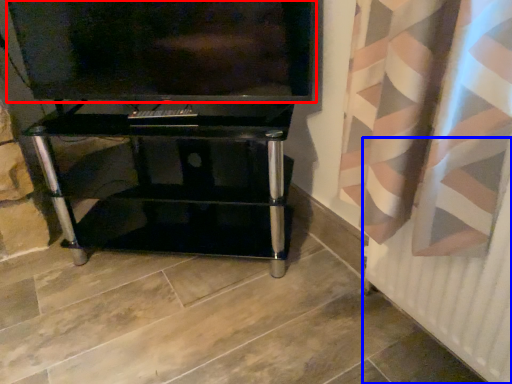
Question: Which point is further to the camera, television (highlighted by a red box) or radiator (highlighted by a blue box)?

Choices:
 (A) television
 (B) radiator

Answer: (A)